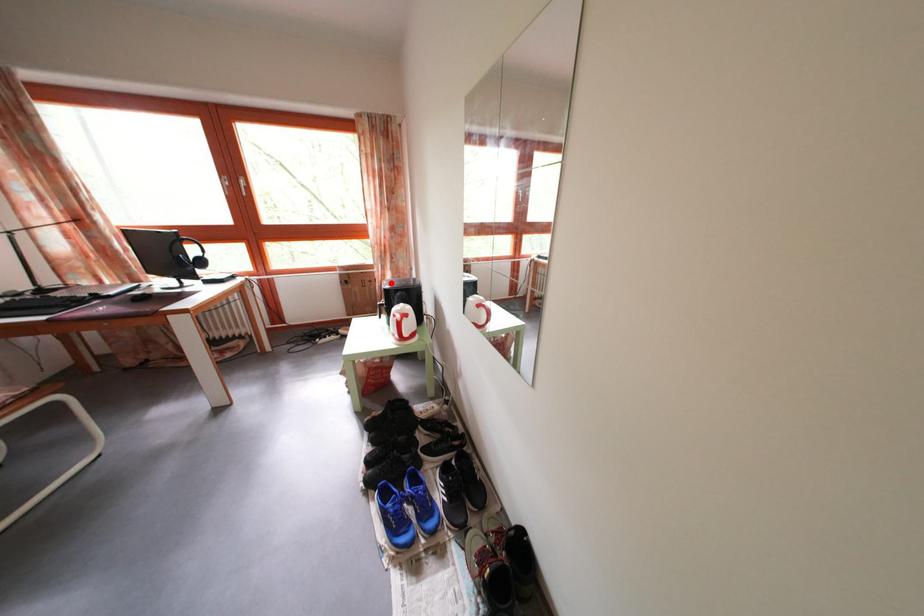
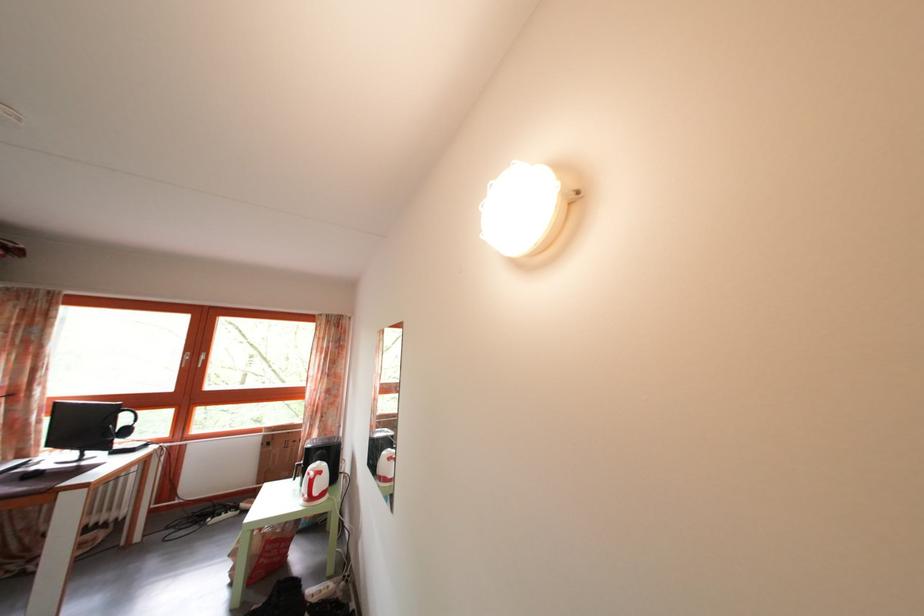
Question: I am providing you with two images of the same scene from different viewpoints. Given a red point in image1, look at the same physical point in image2. Is it:

Choices:
 (A) Closer to the viewpoint
 (B) Farther from the viewpoint

Answer: (A)